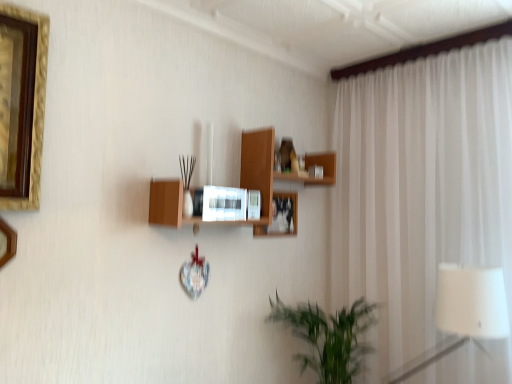
Question: Does white sheer curtain at right contain wooden microwave at center?

Choices:
 (A) yes
 (B) no

Answer: (B)

Question: Is white sheer curtain at right oriented away from wooden microwave at center?

Choices:
 (A) no
 (B) yes

Answer: (A)

Question: Considering the relative positions of white sheer curtain at right and wooden microwave at center in the image provided, is white sheer curtain at right behind wooden microwave at center?

Choices:
 (A) no
 (B) yes

Answer: (B)

Question: Is there a large distance between white sheer curtain at right and wooden microwave at center?

Choices:
 (A) yes
 (B) no

Answer: (B)

Question: From a real-world perspective, is white sheer curtain at right below wooden microwave at center?

Choices:
 (A) yes
 (B) no

Answer: (A)

Question: Is green leafy plant at lower center inside the boundaries of gold-framed picture at left, which ranks as the 2th picture frame in back-to-front order, or outside?

Choices:
 (A) inside
 (B) outside

Answer: (B)

Question: In terms of size, does green leafy plant at lower center appear bigger or smaller than gold-framed picture at left, which is the second picture frame in right-to-left order?

Choices:
 (A) big
 (B) small

Answer: (A)

Question: Looking at their shapes, would you say green leafy plant at lower center is wider or thinner than gold-framed picture at left, which ranks as the 2th picture frame in back-to-front order?

Choices:
 (A) wide
 (B) thin

Answer: (A)

Question: Does point (330, 362) appear closer or farther from the camera than point (9, 243)?

Choices:
 (A) farther
 (B) closer

Answer: (A)

Question: In the image, is gold-framed picture at left, which is the second picture frame in right-to-left order, on the left side or the right side of green leafy plant at lower center?

Choices:
 (A) right
 (B) left

Answer: (B)

Question: Considering the positions of gold-framed picture at left, placed as the first picture frame when sorted from front to back, and green leafy plant at lower center in the image, is gold-framed picture at left, placed as the first picture frame when sorted from front to back, bigger or smaller than green leafy plant at lower center?

Choices:
 (A) small
 (B) big

Answer: (A)

Question: Is gold-framed picture at left, placed as the first picture frame when sorted from front to back, in front of or behind green leafy plant at lower center in the image?

Choices:
 (A) behind
 (B) front

Answer: (B)

Question: Considering the positions of point (1, 256) and point (320, 332), is point (1, 256) closer or farther from the camera than point (320, 332)?

Choices:
 (A) farther
 (B) closer

Answer: (B)

Question: Is wooden microwave at center wider or thinner than gold-framed picture at left, which is the second picture frame in right-to-left order?

Choices:
 (A) wide
 (B) thin

Answer: (A)

Question: Considering the positions of point (325, 162) and point (7, 223), is point (325, 162) closer or farther from the camera than point (7, 223)?

Choices:
 (A) farther
 (B) closer

Answer: (A)